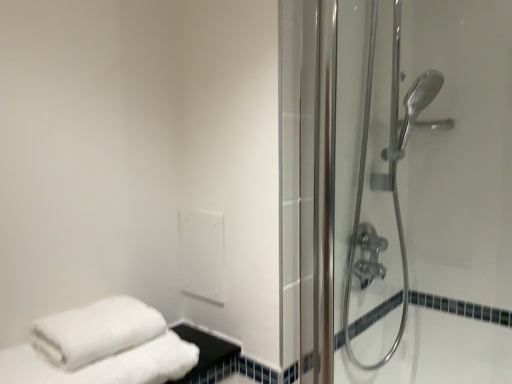
Question: From a real-world perspective, is polished chrome shower door at right, positioned as the second shower door in front-to-back order, under transparent glass shower door at right, the 2th shower door in the back-to-front sequence?

Choices:
 (A) yes
 (B) no

Answer: (B)

Question: Is the surface of polished chrome shower door at right, positioned as the second shower door in front-to-back order, in direct contact with transparent glass shower door at right, the 2th shower door in the back-to-front sequence?

Choices:
 (A) no
 (B) yes

Answer: (A)

Question: Does polished chrome shower door at right, positioned as the second shower door in front-to-back order, have a greater height compared to transparent glass shower door at right, the 2th shower door in the back-to-front sequence?

Choices:
 (A) no
 (B) yes

Answer: (B)

Question: From the image's perspective, would you say polished chrome shower door at right, which is counted as the 1th shower door, starting from the back, is shown under transparent glass shower door at right, the 2th shower door in the back-to-front sequence?

Choices:
 (A) yes
 (B) no

Answer: (B)

Question: Would you say polished chrome shower door at right, which is counted as the 1th shower door, starting from the back, is a long distance from transparent glass shower door at right, positioned as the 1th shower door in front-to-back order?

Choices:
 (A) no
 (B) yes

Answer: (A)

Question: Is polished chrome shower door at right, positioned as the second shower door in front-to-back order, closer to the viewer compared to transparent glass shower door at right, positioned as the 1th shower door in front-to-back order?

Choices:
 (A) no
 (B) yes

Answer: (A)

Question: Is transparent glass shower door at right, positioned as the 1th shower door in front-to-back order, positioned before polished chrome shower door at right, positioned as the second shower door in front-to-back order?

Choices:
 (A) yes
 (B) no

Answer: (A)

Question: Is polished chrome shower door at right, positioned as the second shower door in front-to-back order, at the back of transparent glass shower door at right, the 2th shower door in the back-to-front sequence?

Choices:
 (A) no
 (B) yes

Answer: (B)

Question: From a real-world perspective, is transparent glass shower door at right, positioned as the 1th shower door in front-to-back order, positioned under polished chrome shower door at right, which is counted as the 1th shower door, starting from the back, based on gravity?

Choices:
 (A) yes
 (B) no

Answer: (A)

Question: Is transparent glass shower door at right, the 2th shower door in the back-to-front sequence, not within polished chrome shower door at right, which is counted as the 1th shower door, starting from the back?

Choices:
 (A) no
 (B) yes

Answer: (B)

Question: Would you consider transparent glass shower door at right, positioned as the 1th shower door in front-to-back order, to be distant from polished chrome shower door at right, which is counted as the 1th shower door, starting from the back?

Choices:
 (A) yes
 (B) no

Answer: (B)

Question: Is transparent glass shower door at right, the 2th shower door in the back-to-front sequence, next to polished chrome shower door at right, positioned as the second shower door in front-to-back order, and touching it?

Choices:
 (A) no
 (B) yes

Answer: (A)

Question: In the image, is polished chrome shower door at right, which is counted as the 1th shower door, starting from the back, positioned in front of or behind transparent glass shower door at right, positioned as the 1th shower door in front-to-back order?

Choices:
 (A) behind
 (B) front

Answer: (A)